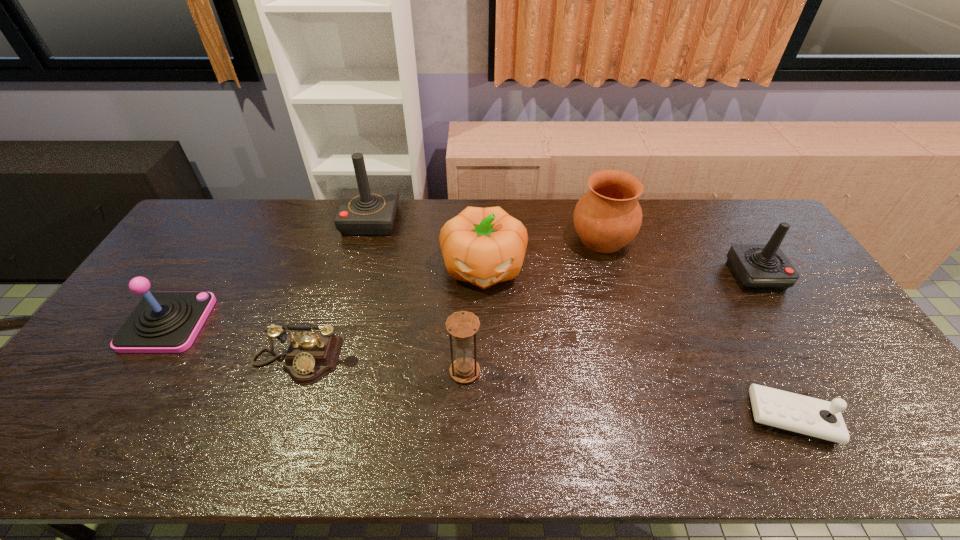
Find the location of `vacant space in between the hourglass and the shortest joystick`. vacant space in between the hourglass and the shortest joystick is located at coordinates (628, 394).

Where is `empty space between the second farthest joystick and the shortest object`? empty space between the second farthest joystick and the shortest object is located at coordinates (774, 347).

Locate an element on the screen. This screenshot has height=540, width=960. empty space that is in between the pumpkin and the shortest object is located at coordinates (637, 342).

This screenshot has width=960, height=540. Find the location of `empty space between the third joystick from right to left and the second nearest joystick`. empty space between the third joystick from right to left and the second nearest joystick is located at coordinates (270, 272).

The image size is (960, 540). What are the coordinates of `unoccupied area between the second shortest object and the third object from right to left` in the screenshot? It's located at (449, 300).

I want to click on empty location between the pottery and the nearest object, so click(697, 328).

Point out which object is positioned as the nearest to the telephone. Please provide its 2D coordinates. Your answer should be formatted as a tuple, i.e. [(x, y)], where the tuple contains the x and y coordinates of a point satisfying the conditions above.

[(163, 322)]

Where is `object that is the closest one to the second farthest joystick`? The image size is (960, 540). object that is the closest one to the second farthest joystick is located at coordinates (606, 218).

At what (x,y) coordinates should I click in order to perform the action: click on joystick that is the third closest to the second farthest joystick. Please return your answer as a coordinate pair (x, y). This screenshot has width=960, height=540. Looking at the image, I should click on (163, 322).

Identify which joystick is the third closest to the second shortest joystick. Please provide its 2D coordinates. Your answer should be formatted as a tuple, i.e. [(x, y)], where the tuple contains the x and y coordinates of a point satisfying the conditions above.

[(757, 267)]